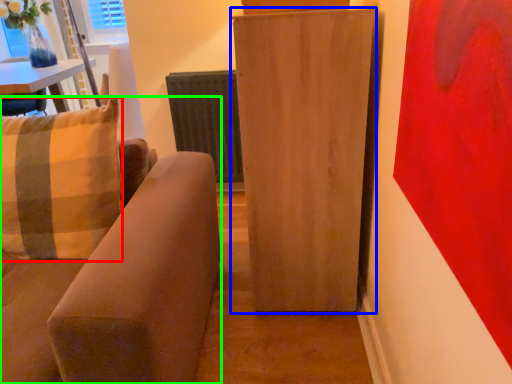
Question: Which object is the closest to the pillow (highlighted by a red box)? Choose among these: furniture (highlighted by a blue box) or studio couch (highlighted by a green box).

Choices:
 (A) furniture
 (B) studio couch

Answer: (B)